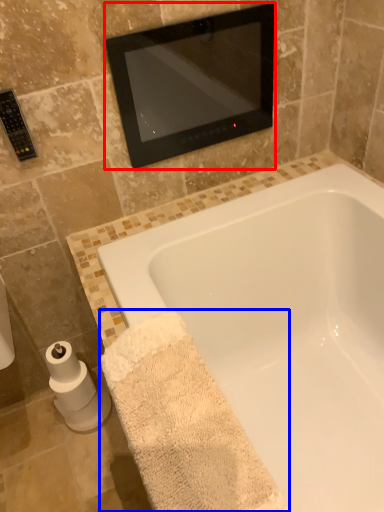
Question: Which point is further to the camera, mirror (highlighted by a red box) or bath towel (highlighted by a blue box)?

Choices:
 (A) mirror
 (B) bath towel

Answer: (A)